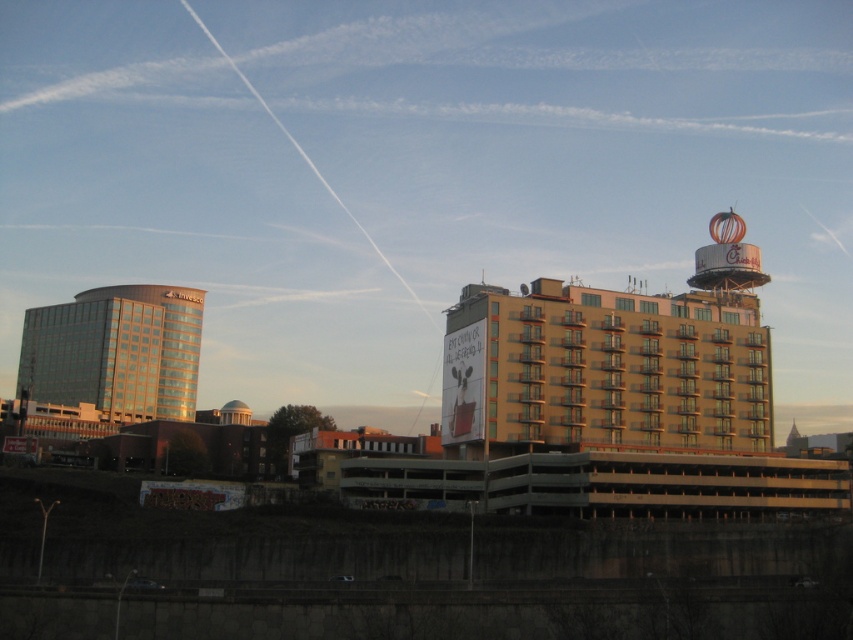
Question: Is yellow concrete building at center bigger than shiny glass building at left?

Choices:
 (A) yes
 (B) no

Answer: (B)

Question: Which object is farther from the camera taking this photo?

Choices:
 (A) shiny glass building at left
 (B) yellow concrete building at center

Answer: (A)

Question: Which object is farther from the camera taking this photo?

Choices:
 (A) shiny glass building at left
 (B) yellow concrete building at center

Answer: (A)

Question: Does yellow concrete building at center have a greater width compared to shiny glass building at left?

Choices:
 (A) no
 (B) yes

Answer: (A)

Question: Can you confirm if yellow concrete building at center is smaller than shiny glass building at left?

Choices:
 (A) no
 (B) yes

Answer: (B)